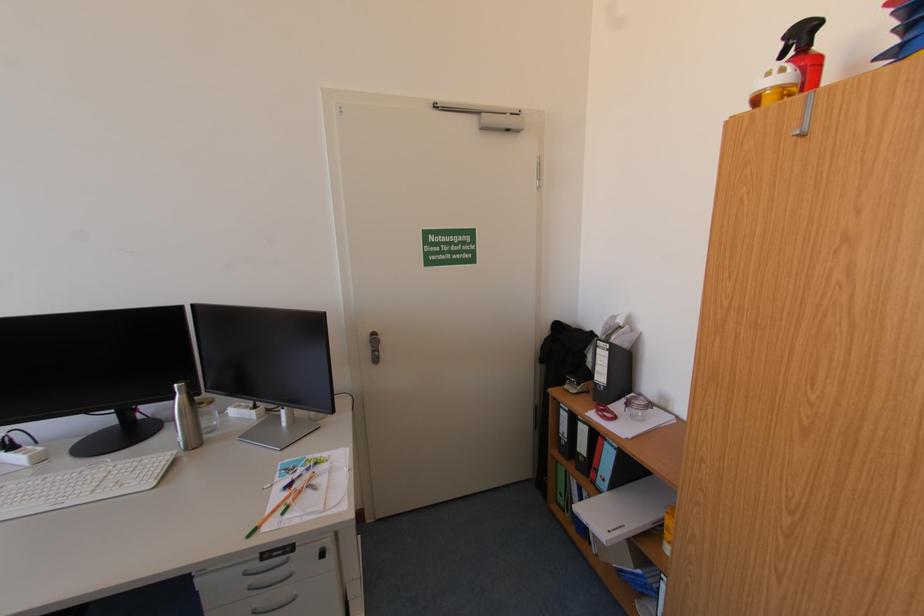
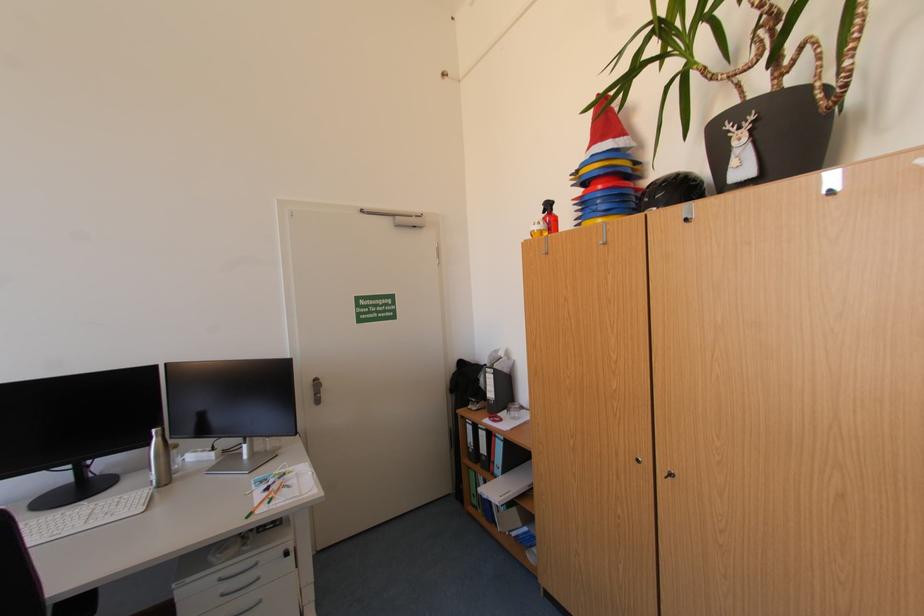
In the second image, find the point that corresponds to (x=789, y=55) in the first image.

(552, 213)